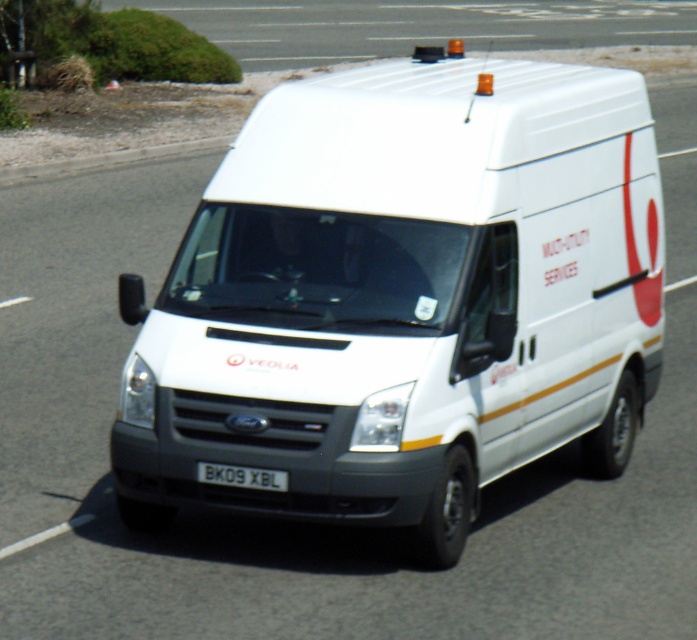
In the scene shown: Is white matte van at center smaller than black plastic license plate at center?

No.

How distant is white matte van at center from black plastic license plate at center?

white matte van at center and black plastic license plate at center are 5.01 feet apart.

Who is more forward, (x=582, y=429) or (x=233, y=476)?

Point (x=233, y=476)

This screenshot has width=697, height=640. What are the coordinates of `white matte van at center` in the screenshot? It's located at (404, 298).